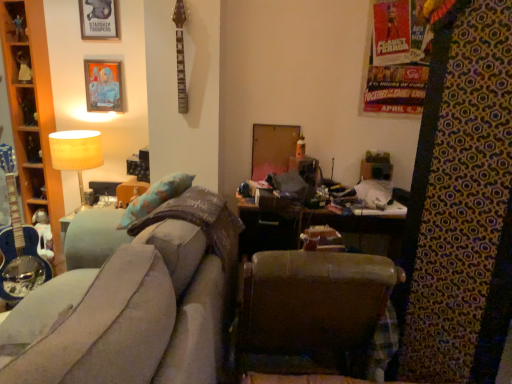
Question: From their relative heights in the image, would you say metallic silver picture frame at upper left, marked as the 1th picture frame in a bottom-to-top arrangement, is taller or shorter than velvet grey couch at center?

Choices:
 (A) short
 (B) tall

Answer: (A)

Question: From a real-world perspective, is metallic silver picture frame at upper left, marked as the 1th picture frame in a bottom-to-top arrangement, physically located above or below velvet grey couch at center?

Choices:
 (A) above
 (B) below

Answer: (A)

Question: Which object is positioned closest to the metallic silver picture frame at upper left, marked as the second picture frame in a top-to-bottom arrangement?

Choices:
 (A) brown leather chair at center
 (B) metallic silver picture frame at upper left, the first picture frame from the top
 (C) wooden cabinet at left
 (D) matte beige lampshade at upper left
 (E) velvet grey couch at center

Answer: (B)

Question: Which object is positioned farthest from the velvet grey couch at center?

Choices:
 (A) matte beige lampshade at upper left
 (B) metallic silver picture frame at upper left, marked as the 1th picture frame in a bottom-to-top arrangement
 (C) metallic silver picture frame at upper left, the 2th picture frame when ordered from bottom to top
 (D) wooden cabinet at left
 (E) brown leather chair at center

Answer: (C)